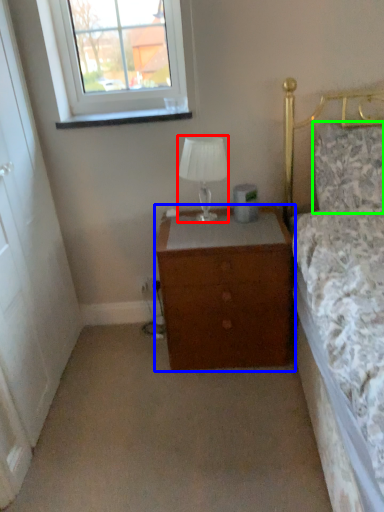
Question: Considering the real-world distances, which object is farthest from lamp (highlighted by a red box)? chest of drawers (highlighted by a blue box) or pillow (highlighted by a green box)?

Choices:
 (A) chest of drawers
 (B) pillow

Answer: (B)